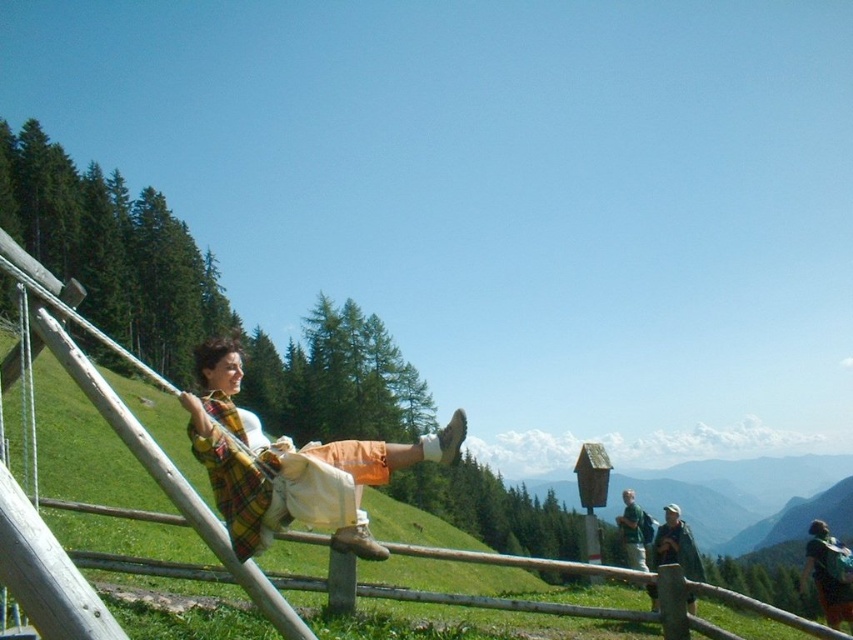
The height and width of the screenshot is (640, 853). What do you see at coordinates (291, 465) in the screenshot?
I see `plaid fabric shirt at center` at bounding box center [291, 465].

Does plaid fabric shirt at center appear on the right side of camouflage jacket at lower right?

In fact, plaid fabric shirt at center is to the left of camouflage jacket at lower right.

Describe the element at coordinates (291, 465) in the screenshot. The height and width of the screenshot is (640, 853). I see `plaid fabric shirt at center` at that location.

Find the location of `plaid fabric shirt at center`. plaid fabric shirt at center is located at coordinates (291, 465).

Does point (416, 442) come behind point (828, 600)?

No, (416, 442) is in front of (828, 600).

Image resolution: width=853 pixels, height=640 pixels. What do you see at coordinates (291, 465) in the screenshot?
I see `plaid fabric shirt at center` at bounding box center [291, 465].

Does point (363, 544) come behind point (831, 621)?

That is False.

Locate an element on the screen. plaid fabric shirt at center is located at coordinates (291, 465).

Can you confirm if camouflage jacket at lower right is taller than green fabric shirt at upper right?

In fact, camouflage jacket at lower right may be shorter than green fabric shirt at upper right.

Who is more forward, [664,524] or [633,524]?

Positioned in front is point [664,524].

Which is in front, point (689, 570) or point (637, 522)?

Point (689, 570)

Where is `camouflage jacket at lower right`? camouflage jacket at lower right is located at coordinates (675, 545).